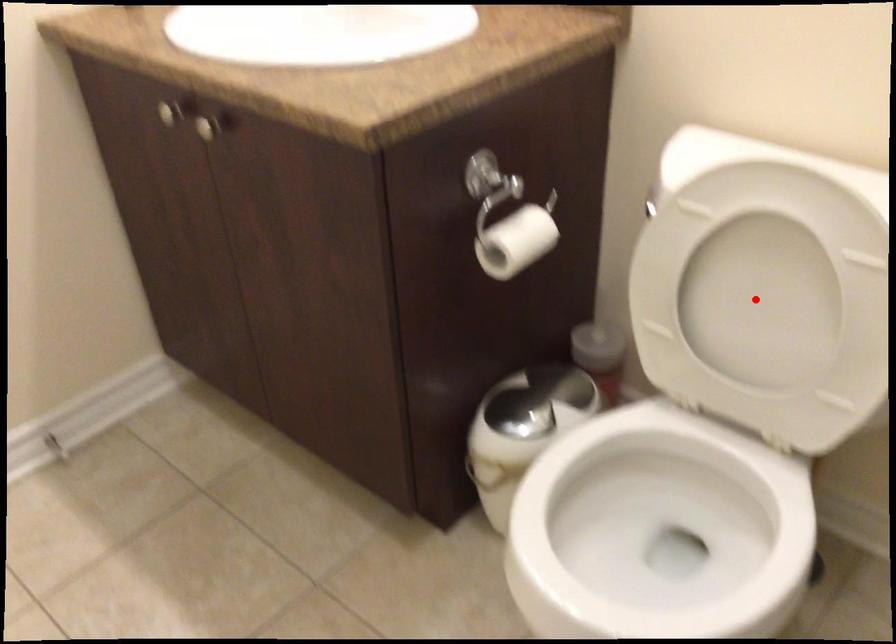
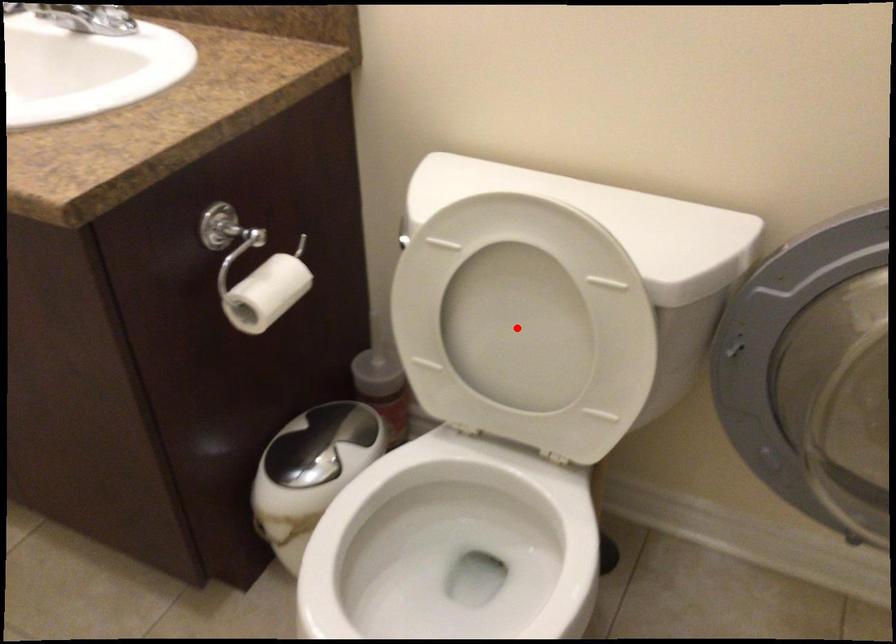
I am providing you with two images of the same scene from different viewpoints. A red point is marked on the first image and another point is marked on the second image. Does the point marked in image1 correspond to the same location as the one in image2?

Yes